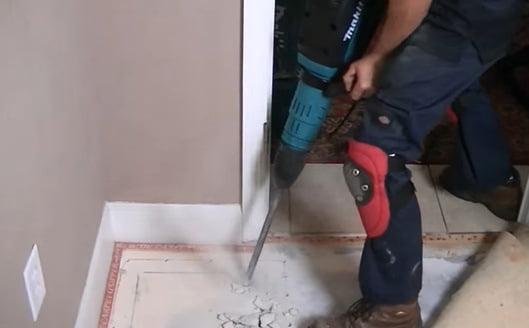
Where is `tile flooring`? This screenshot has height=328, width=529. tile flooring is located at coordinates (282, 224), (319, 214), (464, 224), (186, 306), (321, 303), (433, 304).